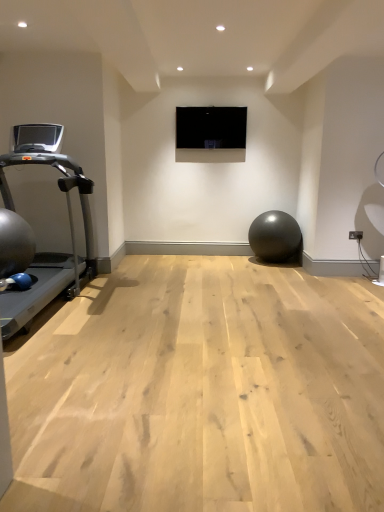
Question: Does matte black ball at center have a greater width compared to silver metallic treadmill at left?

Choices:
 (A) yes
 (B) no

Answer: (B)

Question: Would you say matte black ball at center is a long distance from silver metallic treadmill at left?

Choices:
 (A) yes
 (B) no

Answer: (A)

Question: Considering the relative positions of matte black ball at center and silver metallic treadmill at left in the image provided, is matte black ball at center to the right of silver metallic treadmill at left from the viewer's perspective?

Choices:
 (A) no
 (B) yes

Answer: (B)

Question: Is matte black ball at center to the left of silver metallic treadmill at left from the viewer's perspective?

Choices:
 (A) no
 (B) yes

Answer: (A)

Question: Is matte black ball at center oriented away from silver metallic treadmill at left?

Choices:
 (A) no
 (B) yes

Answer: (A)

Question: Can you confirm if matte black ball at center is taller than silver metallic treadmill at left?

Choices:
 (A) no
 (B) yes

Answer: (A)

Question: Is matte black ball at center not inside black glossy screen at center?

Choices:
 (A) no
 (B) yes

Answer: (B)

Question: From a real-world perspective, is matte black ball at center on top of black glossy screen at center?

Choices:
 (A) yes
 (B) no

Answer: (B)

Question: Considering the relative sizes of matte black ball at center and black glossy screen at center in the image provided, is matte black ball at center wider than black glossy screen at center?

Choices:
 (A) no
 (B) yes

Answer: (B)

Question: Is matte black ball at center further to camera compared to black glossy screen at center?

Choices:
 (A) yes
 (B) no

Answer: (B)

Question: Does matte black ball at center appear on the right side of black glossy screen at center?

Choices:
 (A) no
 (B) yes

Answer: (B)

Question: From a real-world perspective, is matte black ball at center below black glossy screen at center?

Choices:
 (A) yes
 (B) no

Answer: (A)

Question: Is silver metallic treadmill at left wider than matte black ball at center?

Choices:
 (A) no
 (B) yes

Answer: (B)